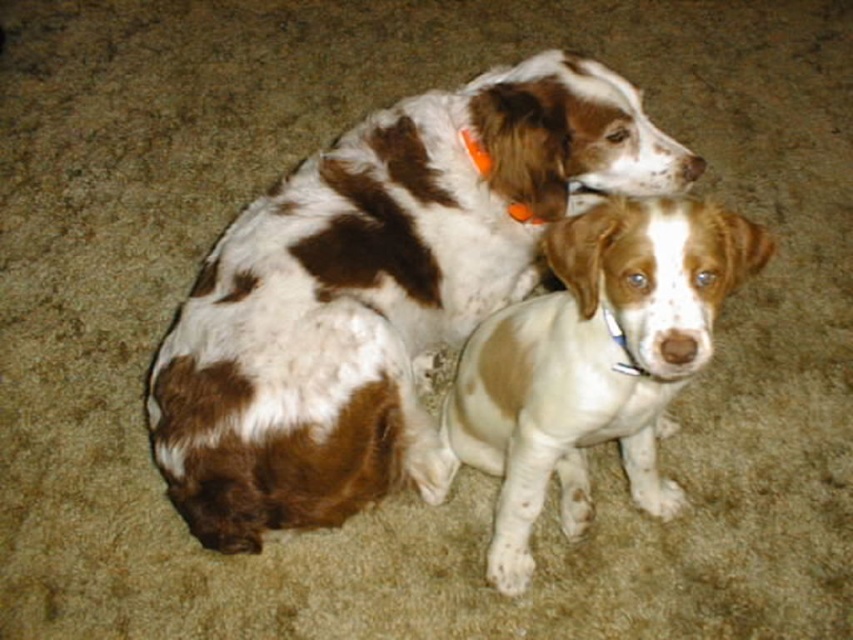
Question: Is the position of brown and white fur at center more distant than that of white speckled fur at center?

Choices:
 (A) yes
 (B) no

Answer: (A)

Question: Does white speckled fur at center have a greater width compared to orange plastic collar at upper center?

Choices:
 (A) no
 (B) yes

Answer: (B)

Question: Which object is the closest to the orange plastic collar at upper center?

Choices:
 (A) white speckled fur at center
 (B) brown and white fur at center

Answer: (B)

Question: Based on their relative distances, which object is farther from the brown and white fur at center?

Choices:
 (A) white speckled fur at center
 (B) orange plastic collar at upper center

Answer: (B)

Question: Which object is positioned closest to the brown and white fur at center?

Choices:
 (A) white speckled fur at center
 (B) orange plastic collar at upper center

Answer: (A)

Question: Can you confirm if brown and white fur at center is positioned above orange plastic collar at upper center?

Choices:
 (A) no
 (B) yes

Answer: (A)